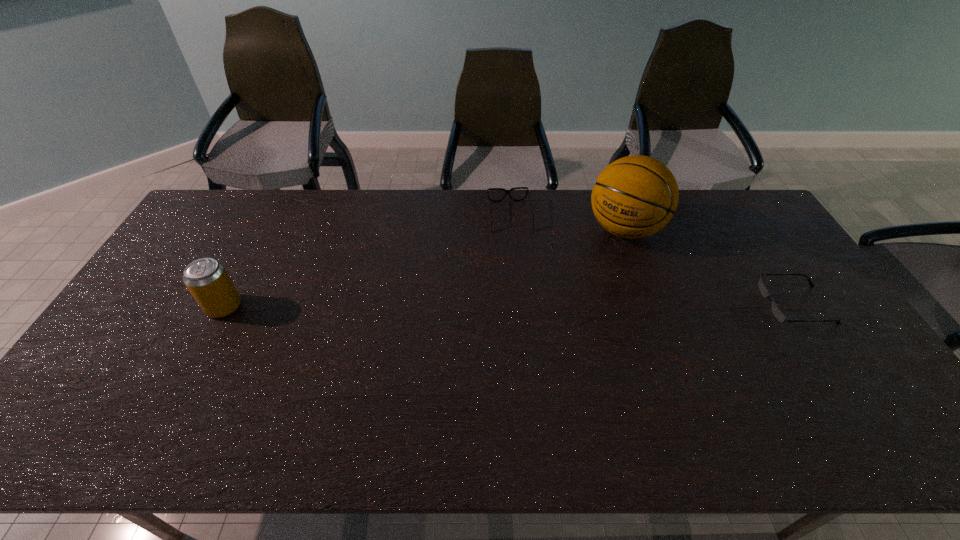
At what (x,y) coordinates should I click in order to perform the action: click on object that is positioned at the right edge. Please return your answer as a coordinate pair (x, y). The height and width of the screenshot is (540, 960). Looking at the image, I should click on (777, 312).

The width and height of the screenshot is (960, 540). In order to click on vacant space at the far edge of the desktop in this screenshot , I will do `click(702, 199)`.

This screenshot has width=960, height=540. What are the coordinates of `free space at the left edge of the desktop` in the screenshot? It's located at (175, 265).

Locate an element on the screen. The image size is (960, 540). vacant space at the right edge of the desktop is located at coordinates (780, 279).

Where is `vacant space at the far right corner of the desktop`? The image size is (960, 540). vacant space at the far right corner of the desktop is located at coordinates tap(730, 230).

Find the location of `free space between the basketball and the nearer spectacles`. free space between the basketball and the nearer spectacles is located at coordinates [x=709, y=267].

The height and width of the screenshot is (540, 960). Identify the location of vacant region between the tallest object and the nearer spectacles. (709, 267).

The height and width of the screenshot is (540, 960). Find the location of `vacant region between the third object from left to right and the rightmost object`. vacant region between the third object from left to right and the rightmost object is located at coordinates (709, 267).

You are a GUI agent. You are given a task and a screenshot of the screen. Output one action in this format:
    pyautogui.click(x=<x>, y=<y>)
    Task: Click on the blank region between the shorter spectacles and the taller spectacles
    This screenshot has width=960, height=540.
    Given the screenshot: What is the action you would take?
    pyautogui.click(x=652, y=261)

Find the location of a particular element. vacant space that's between the pop (soda) and the third object from right to left is located at coordinates (367, 261).